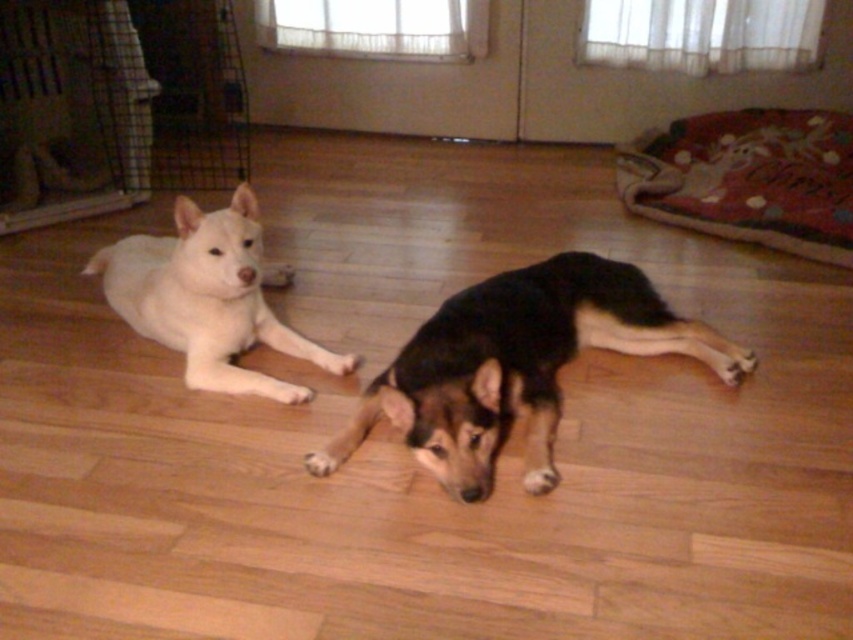
Question: Which of the following is the closest to the observer?

Choices:
 (A) (190, 380)
 (B) (747, 356)

Answer: (A)

Question: Can you confirm if black fur dog at center is wider than white fur dog at left?

Choices:
 (A) no
 (B) yes

Answer: (B)

Question: Does black fur dog at center have a larger size compared to white fur dog at left?

Choices:
 (A) yes
 (B) no

Answer: (A)

Question: Which point is farther to the camera?

Choices:
 (A) black fur dog at center
 (B) white fur dog at left

Answer: (B)

Question: Does black fur dog at center appear on the right side of white fur dog at left?

Choices:
 (A) no
 (B) yes

Answer: (B)